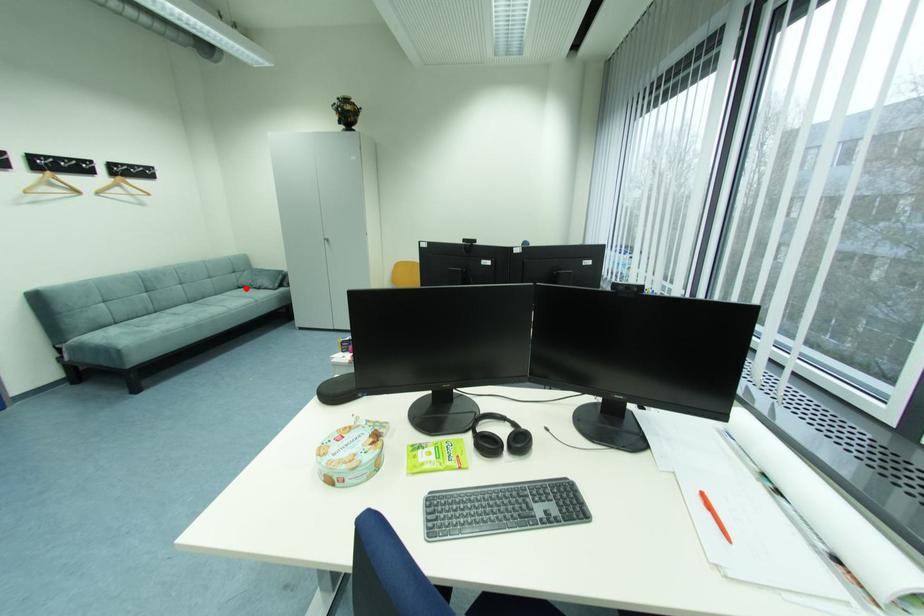
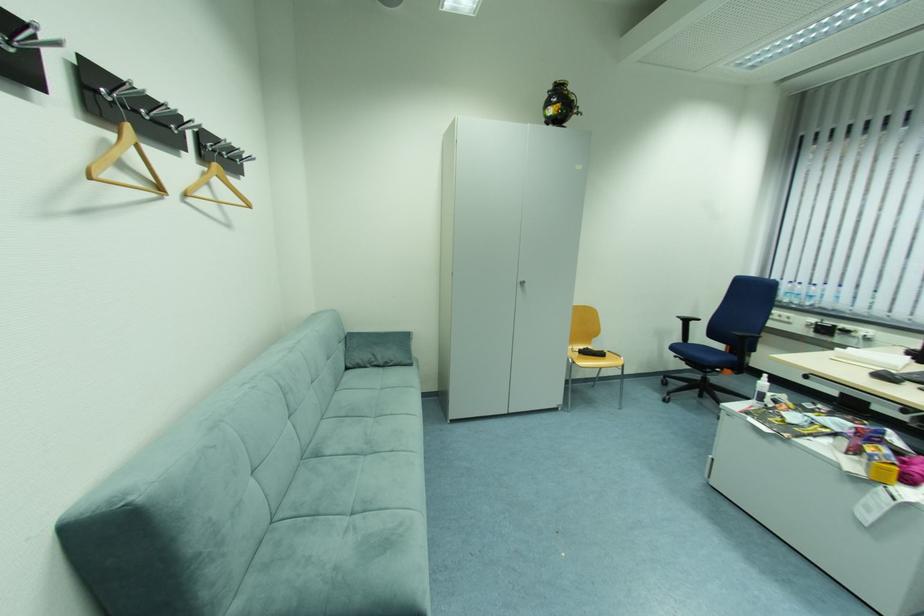
In the second image, find the point that corresponds to the highlighted location in the first image.

(354, 370)